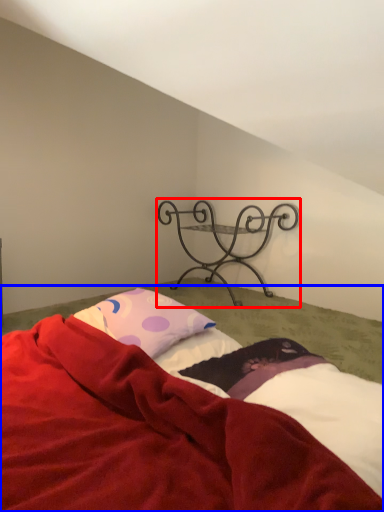
Question: Which of the following is the closest to the observer, furniture (highlighted by a red box) or bed (highlighted by a blue box)?

Choices:
 (A) furniture
 (B) bed

Answer: (B)